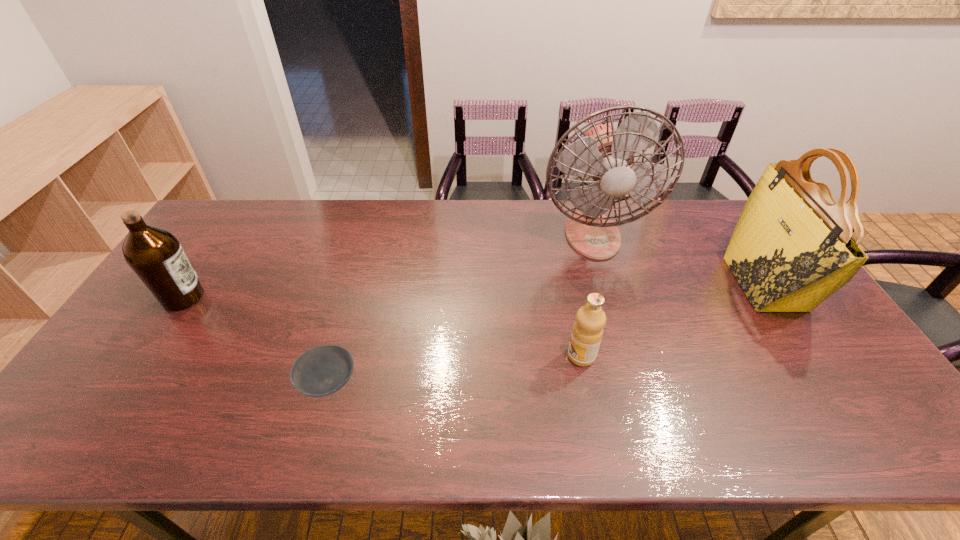
The height and width of the screenshot is (540, 960). Identify the location of object at the right edge. (793, 246).

At what (x,y) coordinates should I click in order to perform the action: click on object that is at the far right corner. Please return your answer as a coordinate pair (x, y). This screenshot has height=540, width=960. Looking at the image, I should click on (793, 246).

Identify the location of vacant region at the far edge. (348, 222).

Where is `vacant region at the near edge of the desktop`? The width and height of the screenshot is (960, 540). vacant region at the near edge of the desktop is located at coordinates (410, 428).

At what (x,y) coordinates should I click in order to perform the action: click on vacant space at the left edge of the desktop. Please return your answer as a coordinate pair (x, y). The image size is (960, 540). Looking at the image, I should click on pyautogui.click(x=156, y=363).

The width and height of the screenshot is (960, 540). In the image, there is a desktop. Identify the location of free region at the right edge. (875, 393).

Locate an element on the screen. This screenshot has width=960, height=540. free region at the near left corner is located at coordinates (72, 417).

Find the location of a particular element. vacant point at the near right corner is located at coordinates (894, 421).

Locate an element on the screen. empty space between the fan and the shorter olive oil is located at coordinates (587, 295).

Where is `vacant area that lies between the fan and the tote bag`? The height and width of the screenshot is (540, 960). vacant area that lies between the fan and the tote bag is located at coordinates (678, 259).